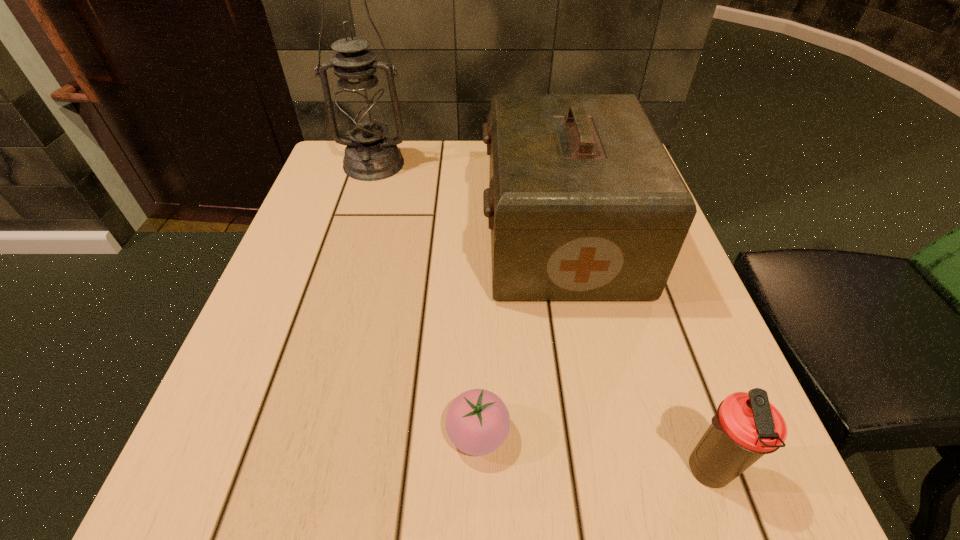
Identify the location of free region at the far edge of the desktop. This screenshot has height=540, width=960. (434, 195).

This screenshot has width=960, height=540. Find the location of `vacant space at the near edge of the desktop`. vacant space at the near edge of the desktop is located at coordinates (306, 517).

Find the location of a particular element. The width and height of the screenshot is (960, 540). vacant region at the left edge of the desktop is located at coordinates (294, 276).

The image size is (960, 540). Find the location of `free space at the right edge of the desktop`. free space at the right edge of the desktop is located at coordinates (648, 370).

Where is `free region at the far left corner`? free region at the far left corner is located at coordinates (359, 181).

Identify the location of free space at the near left corner of the desktop. The width and height of the screenshot is (960, 540). (173, 496).

Locate an element on the screen. This screenshot has height=540, width=960. unoccupied position between the thermos bottle and the tomato is located at coordinates click(592, 452).

Where is `free area in between the shortest object and the thermos bottle`? free area in between the shortest object and the thermos bottle is located at coordinates (592, 452).

Find the location of `vacant space that is in between the tomato and the tallest object`. vacant space that is in between the tomato and the tallest object is located at coordinates (426, 299).

You are a GUI agent. You are given a task and a screenshot of the screen. Output one action in this format:
    pyautogui.click(x=<x>, y=<y>)
    Task: Click on the free space between the second farthest object and the tomato
    This screenshot has width=960, height=540.
    Given the screenshot: What is the action you would take?
    pyautogui.click(x=519, y=336)